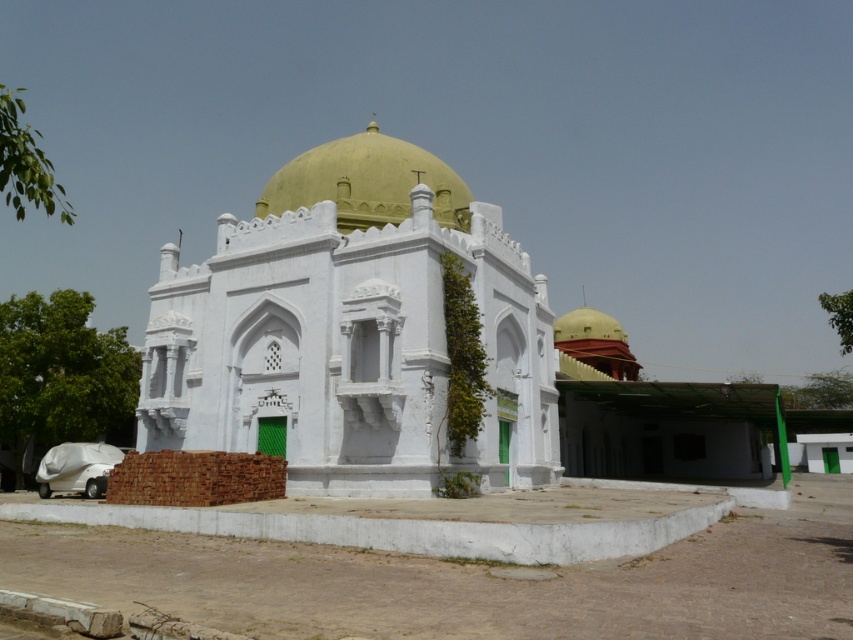
Which is below, white stone dome at center or golden polished dome at center?

Positioned lower is white stone dome at center.

Is white stone dome at center closer to camera compared to golden polished dome at center?

Yes, it is.

Describe the element at coordinates (350, 330) in the screenshot. I see `white stone dome at center` at that location.

Image resolution: width=853 pixels, height=640 pixels. What are the coordinates of `white stone dome at center` in the screenshot? It's located at (350, 330).